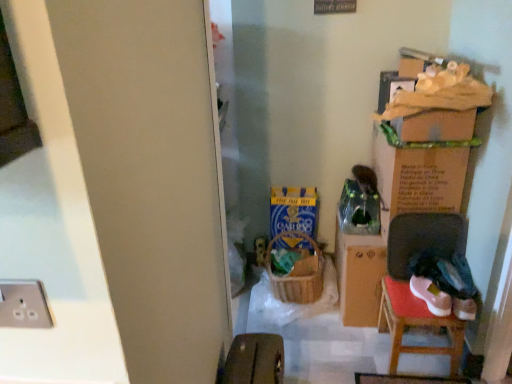
Question: Should I look upward or downward to see silver metallic socket at lower left?

Choices:
 (A) up
 (B) down

Answer: (B)

Question: Is matte brown suitcase at lower center oriented towards wooden chair at lower right?

Choices:
 (A) no
 (B) yes

Answer: (A)

Question: Would you say matte brown suitcase at lower center is a long distance from wooden chair at lower right?

Choices:
 (A) no
 (B) yes

Answer: (A)

Question: Is matte brown suitcase at lower center shorter than wooden chair at lower right?

Choices:
 (A) no
 (B) yes

Answer: (B)

Question: Is matte brown suitcase at lower center positioned behind wooden chair at lower right?

Choices:
 (A) no
 (B) yes

Answer: (A)

Question: Is matte brown suitcase at lower center completely or partially outside of wooden chair at lower right?

Choices:
 (A) no
 (B) yes

Answer: (B)

Question: From the image's perspective, would you say matte brown suitcase at lower center is positioned over wooden chair at lower right?

Choices:
 (A) no
 (B) yes

Answer: (A)

Question: Is matte brown suitcase at lower center bigger than woven brown laundry basket at center?

Choices:
 (A) no
 (B) yes

Answer: (A)

Question: Is matte brown suitcase at lower center taller than woven brown laundry basket at center?

Choices:
 (A) no
 (B) yes

Answer: (A)

Question: Considering the relative sizes of matte brown suitcase at lower center and woven brown laundry basket at center in the image provided, is matte brown suitcase at lower center thinner than woven brown laundry basket at center?

Choices:
 (A) no
 (B) yes

Answer: (B)

Question: From a real-world perspective, is matte brown suitcase at lower center located higher than woven brown laundry basket at center?

Choices:
 (A) yes
 (B) no

Answer: (A)

Question: From the image's perspective, does matte brown suitcase at lower center appear higher than woven brown laundry basket at center?

Choices:
 (A) no
 (B) yes

Answer: (A)

Question: Does matte brown suitcase at lower center turn towards woven brown laundry basket at center?

Choices:
 (A) yes
 (B) no

Answer: (B)

Question: Considering the relative sizes of cardboard box at upper right, the first cardboard box viewed from the right, and silver metallic socket at lower left in the image provided, is cardboard box at upper right, the first cardboard box viewed from the right, smaller than silver metallic socket at lower left?

Choices:
 (A) no
 (B) yes

Answer: (A)